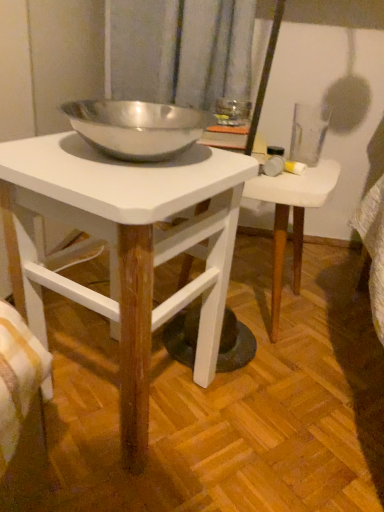
This screenshot has height=512, width=384. In order to click on unoccupied area behind white wood table at center, which is the first table in back-to-front order in this screenshot , I will do point(273,257).